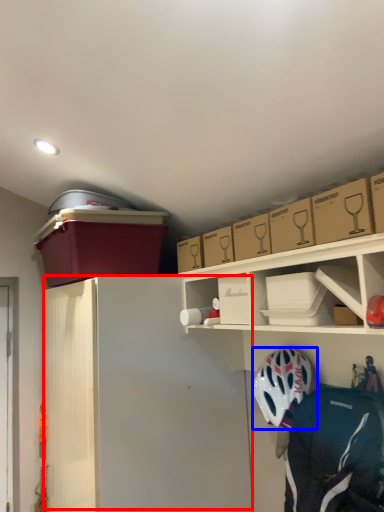
Question: Which of the following is the farthest to the observer, wide (highlighted by a red box) or helmet (highlighted by a blue box)?

Choices:
 (A) wide
 (B) helmet

Answer: (A)